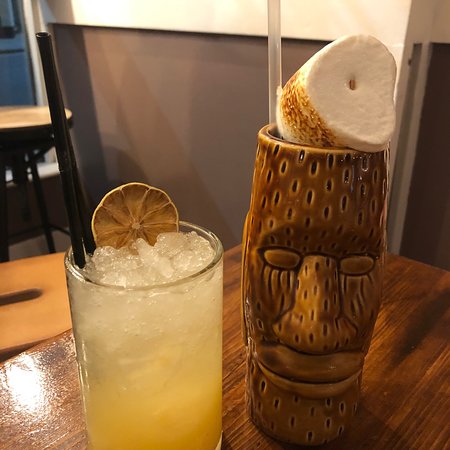
Identify the location of wooden table. The image size is (450, 450). (55, 410), (230, 306), (410, 329).